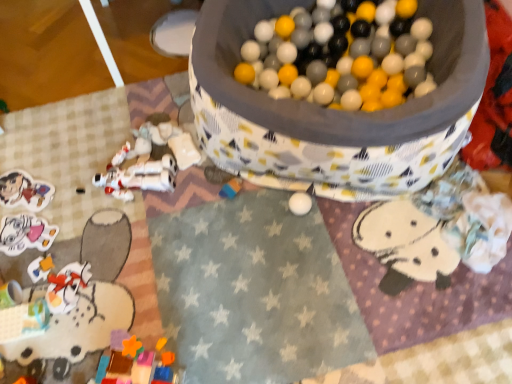
The image size is (512, 384). I want to click on vacant area that lies between matte white sticker at lower left, the 5th toy when ordered from right to left, and white plastic astronaut at lower left, placed as the 3th toy when sorted from right to left, so click(x=81, y=211).